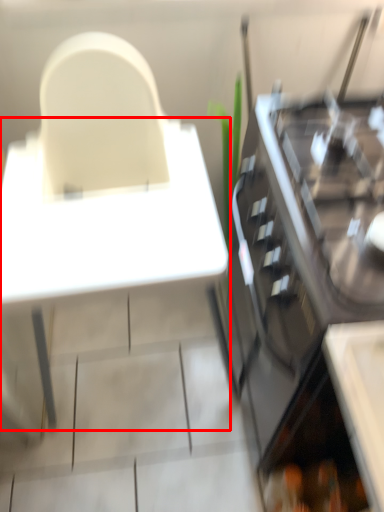
Question: Observing the image, what is the correct spatial positioning of table (annotated by the red box) in reference to cabinetry?

Choices:
 (A) right
 (B) left

Answer: (B)